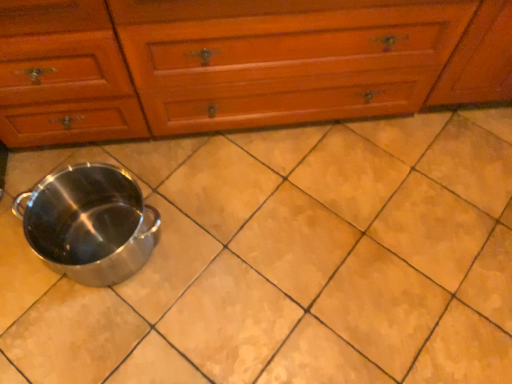
Question: From a real-world perspective, relative to wooden chest of drawers at center, is matte ceramic tile at center vertically above or below?

Choices:
 (A) below
 (B) above

Answer: (A)

Question: Is point (452, 158) closer or farther from the camera than point (3, 114)?

Choices:
 (A) farther
 (B) closer

Answer: (A)

Question: Considering the real-world distances, which object is closest to the wooden chest of drawers at center?

Choices:
 (A) satin silver crock pot at lower left
 (B) matte ceramic tile at center

Answer: (A)

Question: Which is nearer to the satin silver crock pot at lower left?

Choices:
 (A) matte ceramic tile at center
 (B) wooden chest of drawers at center

Answer: (A)